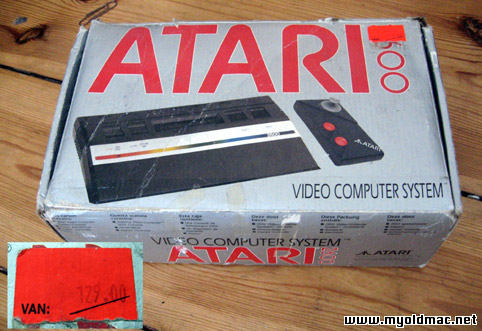
Image resolution: width=482 pixels, height=331 pixels. What are the coordinates of `console` in the screenshot? It's located at (217, 161).